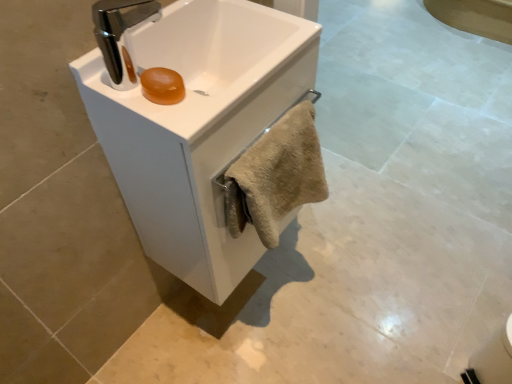
Locate an element on the screen. This screenshot has width=512, height=384. vacant area that is situated to the right of white glossy sink at center, marked as the 1th sink in a back-to-front arrangement is located at coordinates (323, 292).